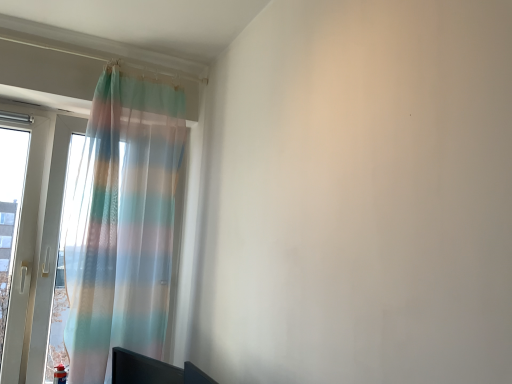
Question: Considering the positions of point (106, 188) and point (199, 375), is point (106, 188) closer or farther from the camera than point (199, 375)?

Choices:
 (A) closer
 (B) farther

Answer: (B)

Question: From their relative heights in the image, would you say translucent pastel striped curtain at left is taller or shorter than black glossy monitor at lower left?

Choices:
 (A) short
 (B) tall

Answer: (B)

Question: Based on their sizes in the image, would you say translucent pastel striped curtain at left is bigger or smaller than black glossy monitor at lower left?

Choices:
 (A) big
 (B) small

Answer: (A)

Question: Is point (115, 375) positioned closer to the camera than point (121, 119)?

Choices:
 (A) farther
 (B) closer

Answer: (B)

Question: Considering the positions of black glossy monitor at lower left and translucent pastel striped curtain at left in the image, is black glossy monitor at lower left bigger or smaller than translucent pastel striped curtain at left?

Choices:
 (A) small
 (B) big

Answer: (A)

Question: Considering their positions, is black glossy monitor at lower left located in front of or behind translucent pastel striped curtain at left?

Choices:
 (A) front
 (B) behind

Answer: (A)

Question: Choose the correct answer: Is black glossy monitor at lower left inside translucent pastel striped curtain at left or outside it?

Choices:
 (A) inside
 (B) outside

Answer: (B)